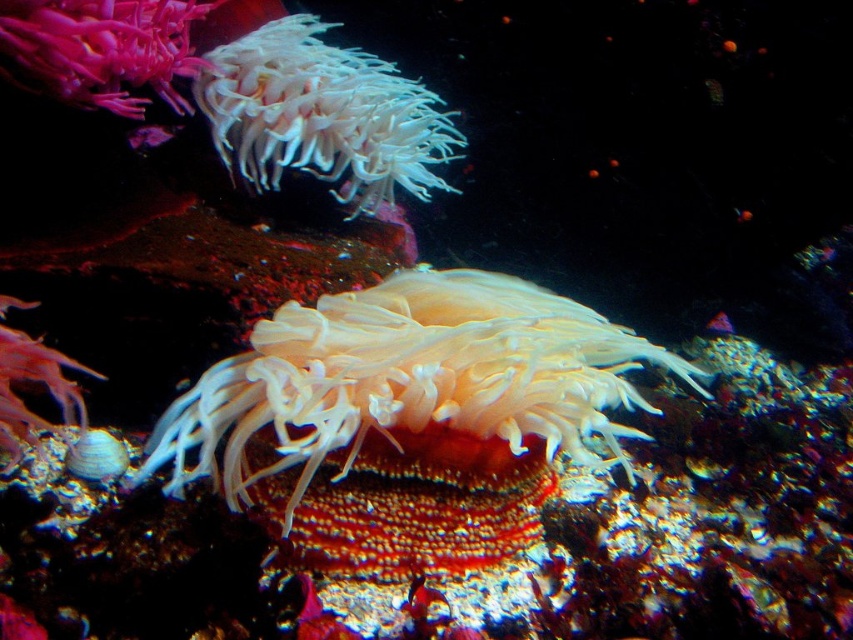
Question: Estimate the real-world distances between objects in this image. Which object is closer to the translucent white anemone at center?

Choices:
 (A) smooth pink coral at upper left
 (B) white soft coral at upper center

Answer: (B)

Question: Does translucent white anemone at center appear on the right side of smooth pink coral at upper left?

Choices:
 (A) yes
 (B) no

Answer: (A)

Question: Can you confirm if translucent white anemone at center is bigger than white soft coral at upper center?

Choices:
 (A) no
 (B) yes

Answer: (B)

Question: Which object is positioned farthest from the smooth pink coral at upper left?

Choices:
 (A) white soft coral at upper center
 (B) translucent white anemone at center

Answer: (B)

Question: Which of the following is the closest to the observer?

Choices:
 (A) smooth pink coral at upper left
 (B) white soft coral at upper center

Answer: (A)

Question: Is translucent white anemone at center above smooth pink coral at upper left?

Choices:
 (A) no
 (B) yes

Answer: (A)